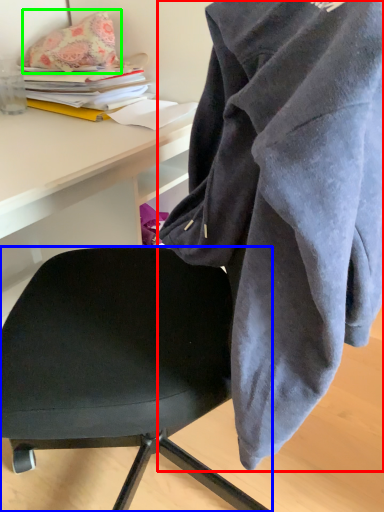
Question: Which object is the closest to the cloak (highlighted by a red box)? Choose among these: chair (highlighted by a blue box) or pillow (highlighted by a green box).

Choices:
 (A) chair
 (B) pillow

Answer: (A)